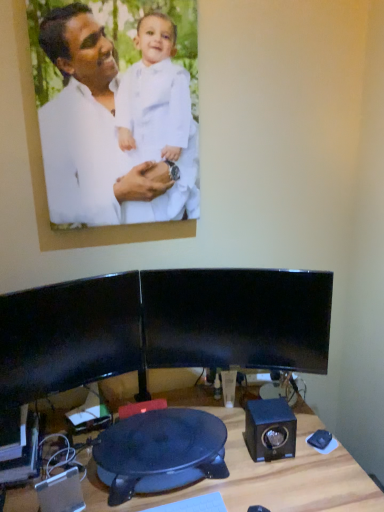
The image size is (384, 512). What are the coordinates of `free location to the right of blue matte speaker at lower right, the first speaker viewed from the back` in the screenshot? It's located at (320, 458).